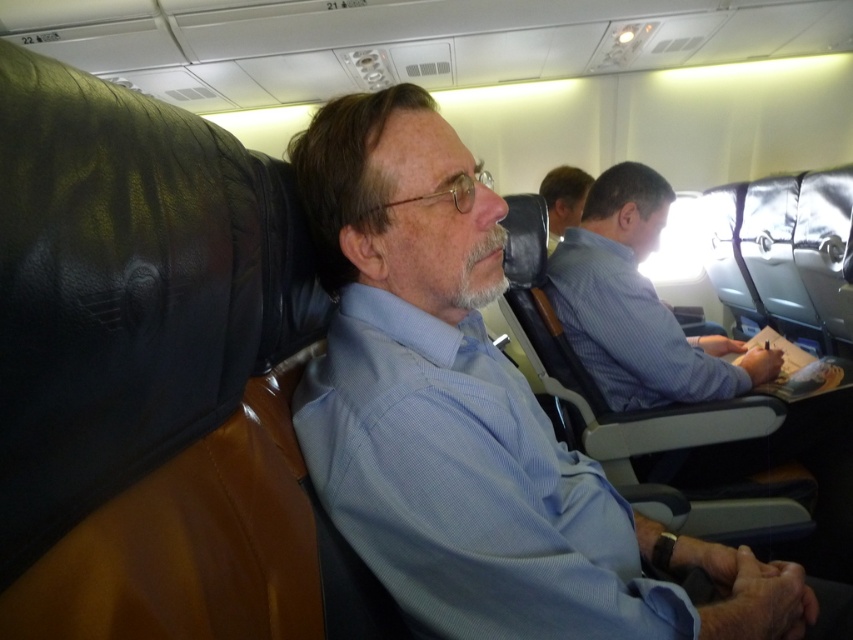
Question: Estimate the real-world distances between objects in this image. Which object is closer to the blue textured shirt at center?

Choices:
 (A) light blue shirt at center
 (B) blue shirt at center
 (C) blue fabric shirt at center

Answer: (C)

Question: Which point is closer to the camera?

Choices:
 (A) blue shirt at center
 (B) light blue shirt at center
 (C) blue fabric shirt at center

Answer: (C)

Question: Is blue fabric shirt at center closer to camera compared to blue textured shirt at center?

Choices:
 (A) yes
 (B) no

Answer: (B)

Question: Can you confirm if blue textured shirt at center is positioned to the right of blue shirt at center?

Choices:
 (A) yes
 (B) no

Answer: (B)

Question: Which is farther from the light blue shirt at center?

Choices:
 (A) blue shirt at center
 (B) blue textured shirt at center
 (C) blue fabric shirt at center

Answer: (B)

Question: Does blue fabric shirt at center appear over blue shirt at center?

Choices:
 (A) no
 (B) yes

Answer: (A)